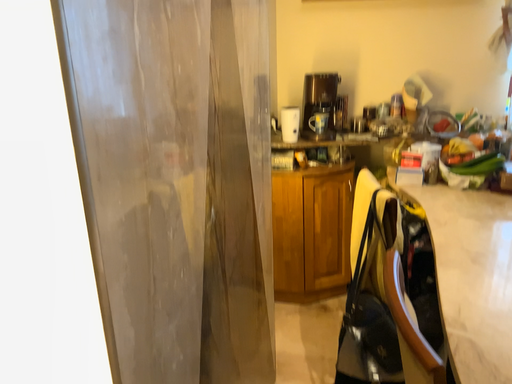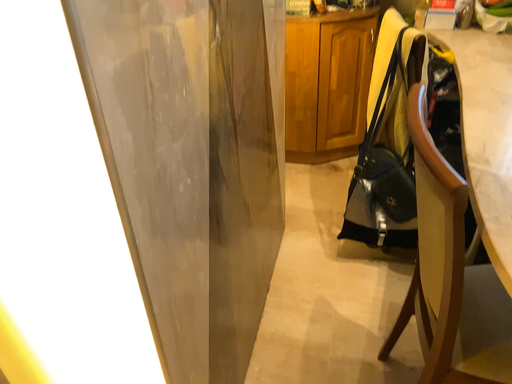
Question: Which way did the camera rotate in the video?

Choices:
 (A) rotated upward
 (B) rotated downward

Answer: (B)